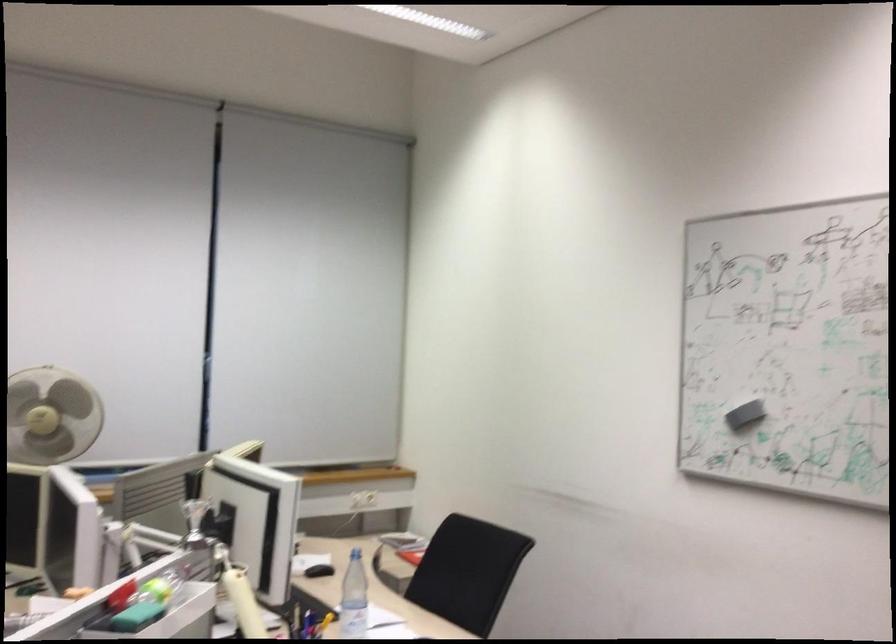
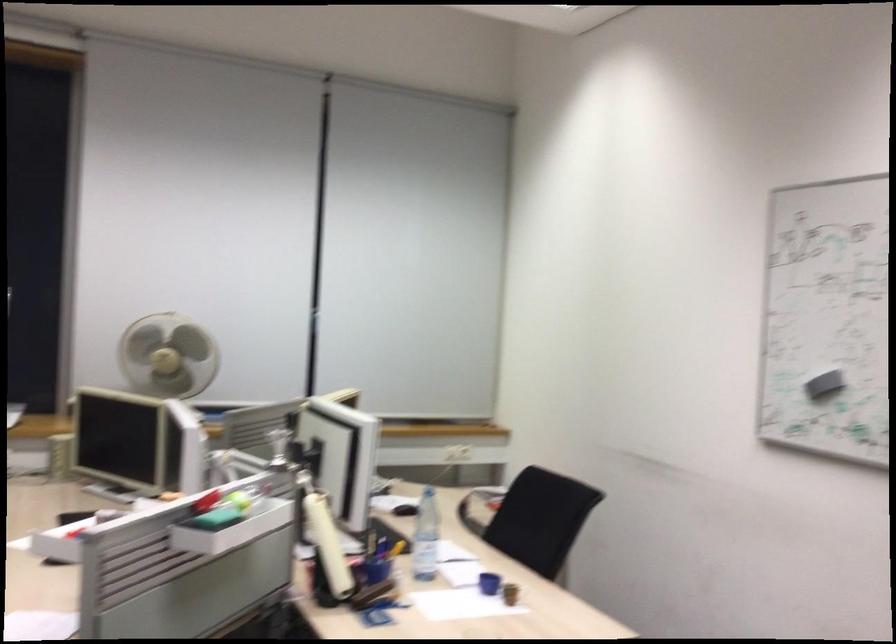
In a continuous first-person perspective shot, in which direction is the camera moving?

The cameraman moved toward right, backward.